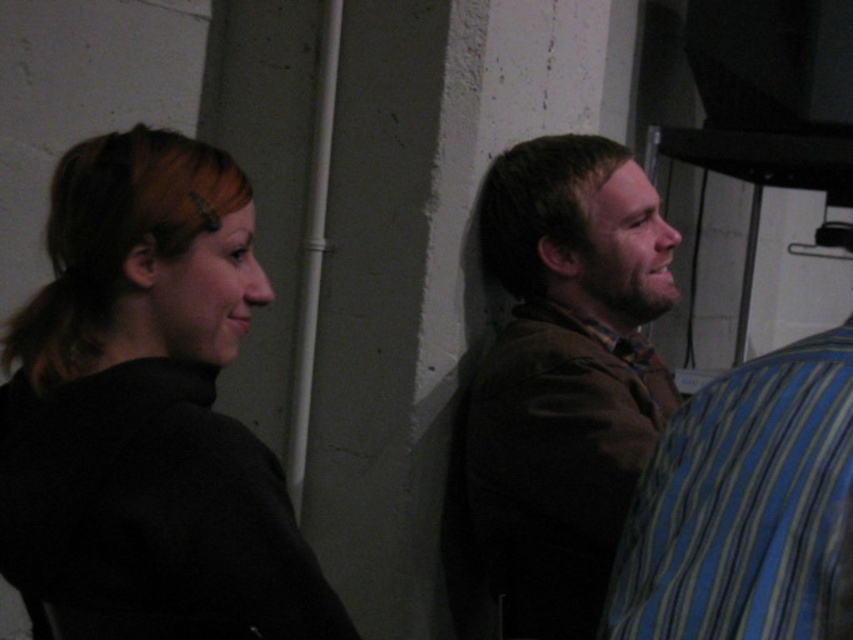
Is black matte hair at left bigger than blue striped shirt at right?

Yes, black matte hair at left is bigger than blue striped shirt at right.

Who is positioned more to the right, black matte hair at left or blue striped shirt at right?

blue striped shirt at right is more to the right.

Does point (277, 486) come farther from viewer compared to point (712, 445)?

Yes, point (277, 486) is behind point (712, 445).

You are a GUI agent. You are given a task and a screenshot of the screen. Output one action in this format:
    pyautogui.click(x=<x>, y=<y>)
    Task: Click on the black matte hair at left
    The image size is (853, 640).
    Given the screenshot: What is the action you would take?
    pyautogui.click(x=148, y=412)

Which is below, brown fabric jacket at center or blue striped shirt at right?

blue striped shirt at right

Does brown fabric jacket at center have a larger size compared to blue striped shirt at right?

Correct, brown fabric jacket at center is larger in size than blue striped shirt at right.

Who is more distant from viewer, (488, 484) or (752, 472)?

Positioned behind is point (488, 484).

Locate an element on the screen. The image size is (853, 640). brown fabric jacket at center is located at coordinates (556, 388).

Does point (169, 541) come farther from viewer compared to point (616, 364)?

No, it is not.

Between point (65, 384) and point (524, 488), which one is positioned in front?

Point (65, 384) is in front.

Which is in front, point (126, 348) or point (619, 150)?

Point (126, 348)

This screenshot has width=853, height=640. I want to click on black matte hair at left, so click(148, 412).